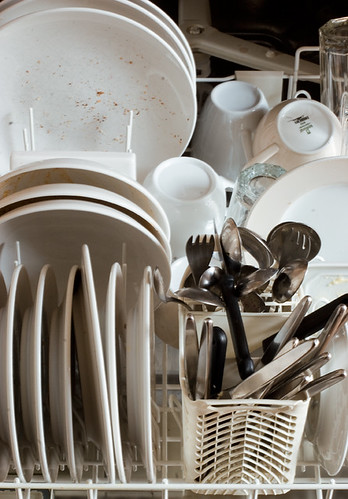
Locate an element on the screen. drinking cups is located at coordinates (195, 198), (253, 181), (243, 97), (294, 125), (338, 48).